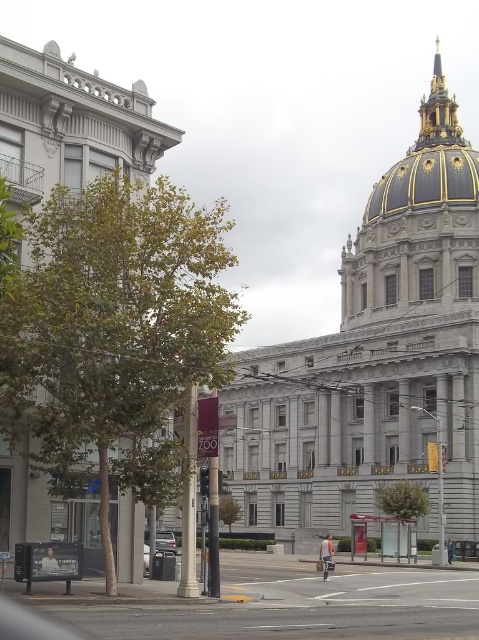
Does gold/gilded stone spire at upper right have a greater height compared to metallic silver car at lower center?

Indeed, gold/gilded stone spire at upper right has a greater height compared to metallic silver car at lower center.

Does point (446, 141) come closer to viewer compared to point (166, 536)?

No, (446, 141) is further to viewer.

At what (x,y) coordinates should I click in order to perform the action: click on gold/gilded stone spire at upper right. Please return your answer as a coordinate pair (x, y). The height and width of the screenshot is (640, 479). Looking at the image, I should click on (437, 113).

Where is `gold/gilded stone spire at upper right`? The height and width of the screenshot is (640, 479). gold/gilded stone spire at upper right is located at coordinates (437, 113).

Which is more to the left, gold/gilded dome at upper right or gold/gilded stone spire at upper right?

gold/gilded dome at upper right is more to the left.

Is gold/gilded dome at upper right in front of gold/gilded stone spire at upper right?

Yes, it is.

What do you see at coordinates (430, 161) in the screenshot? I see `gold/gilded dome at upper right` at bounding box center [430, 161].

Locate an element on the screen. The width and height of the screenshot is (479, 640). gold/gilded dome at upper right is located at coordinates (430, 161).

Between gold/gilded dome at upper right and metallic silver car at lower center, which one has more height?

With more height is gold/gilded dome at upper right.

Who is higher up, gold/gilded dome at upper right or metallic silver car at lower center?

gold/gilded dome at upper right is higher up.

Is point (375, 196) more distant than point (160, 547)?

Yes, point (375, 196) is farther from viewer.

Find the location of a particular element. The width and height of the screenshot is (479, 640). gold/gilded dome at upper right is located at coordinates [x=430, y=161].